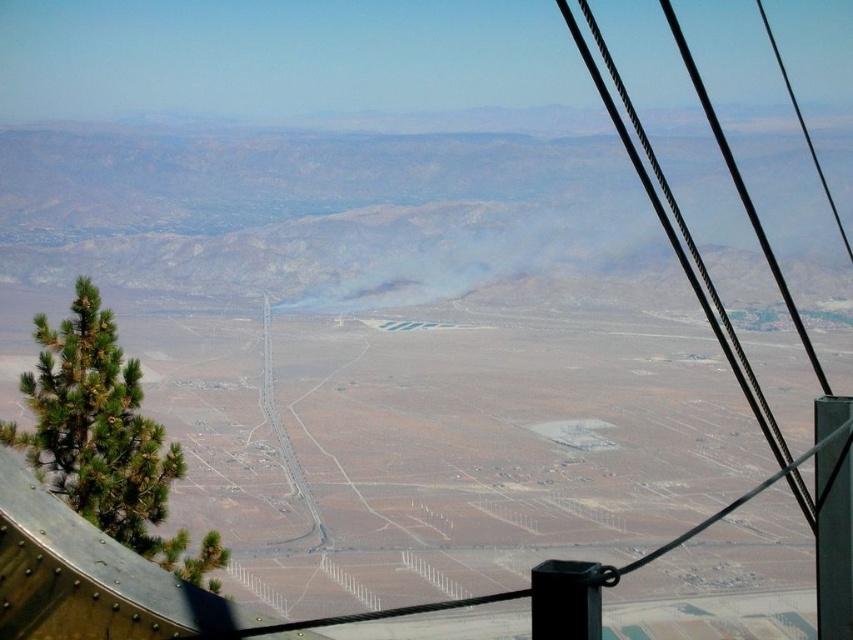
Does brown rocky mountain at center appear over black metal pole at right?

Yes.

Which is above, brown rocky mountain at center or black metal pole at right?

brown rocky mountain at center

Which is behind, point (706, 241) or point (825, 627)?

The point (706, 241) is more distant.

Image resolution: width=853 pixels, height=640 pixels. What are the coordinates of `brown rocky mountain at center` in the screenshot? It's located at (312, 204).

Describe the element at coordinates (686, 275) in the screenshot. This screenshot has width=853, height=640. I see `metallic wire at right` at that location.

Measure the distance between point [808,337] and camera.

Point [808,337] and camera are 2641.62 feet apart.

Between point (642, 128) and point (817, 486), which one is positioned behind?

The point (642, 128) is behind.

I want to click on metallic wire at right, so click(x=686, y=275).

Does brown rocky mountain at center appear under metallic wire at right?

No.

Which is in front, point (722, 177) or point (688, 276)?

Point (688, 276)

Does point (314, 179) come in front of point (670, 244)?

Yes, it is.

Find the location of a particular element. brown rocky mountain at center is located at coordinates point(312,204).